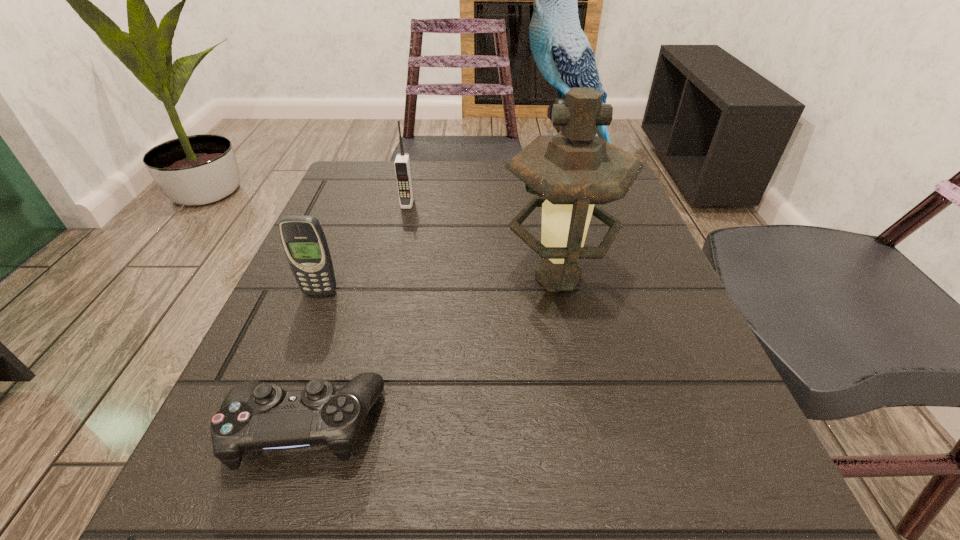
The width and height of the screenshot is (960, 540). I want to click on free space that satisfies the following two spatial constraints: 1. on the front-facing side of the farther cellular telephone; 2. on the right side of the oil lamp, so click(x=390, y=278).

You are a GUI agent. You are given a task and a screenshot of the screen. Output one action in this format:
    pyautogui.click(x=<x>, y=<y>)
    Task: Click on the vacant space that satisfies the following two spatial constraints: 1. on the face of the parakeet; 2. on the screen of the left cellular telephone
    The image size is (960, 540).
    Given the screenshot: What is the action you would take?
    pyautogui.click(x=601, y=293)

Where is `blank space that satisfies the following two spatial constraints: 1. on the face of the tallest object; 2. on the front-facing side of the third shortest object`? The width and height of the screenshot is (960, 540). blank space that satisfies the following two spatial constraints: 1. on the face of the tallest object; 2. on the front-facing side of the third shortest object is located at coordinates (574, 204).

At what (x,y) coordinates should I click in order to perform the action: click on free point that satisfies the following two spatial constraints: 1. on the front-facing side of the third tallest object; 2. on the left side of the fourth shortest object. Please return your answer as a coordinate pair (x, y). The height and width of the screenshot is (540, 960). Looking at the image, I should click on (390, 278).

You are a GUI agent. You are given a task and a screenshot of the screen. Output one action in this format:
    pyautogui.click(x=<x>, y=<y>)
    Task: Click on the vacant space that satisfies the following two spatial constraints: 1. on the front-facing side of the taller cellular telephone; 2. on the left side of the oil lamp
    The image size is (960, 540).
    Given the screenshot: What is the action you would take?
    pyautogui.click(x=390, y=278)

In order to click on free spot that satisfies the following two spatial constraints: 1. on the face of the tallest object; 2. on the front-facing side of the farther cellular telephone in this screenshot , I will do `click(574, 204)`.

Where is `free space that satisfies the following two spatial constraints: 1. on the face of the tallest object; 2. on the front-facing side of the right cellular telephone`? The width and height of the screenshot is (960, 540). free space that satisfies the following two spatial constraints: 1. on the face of the tallest object; 2. on the front-facing side of the right cellular telephone is located at coordinates (574, 204).